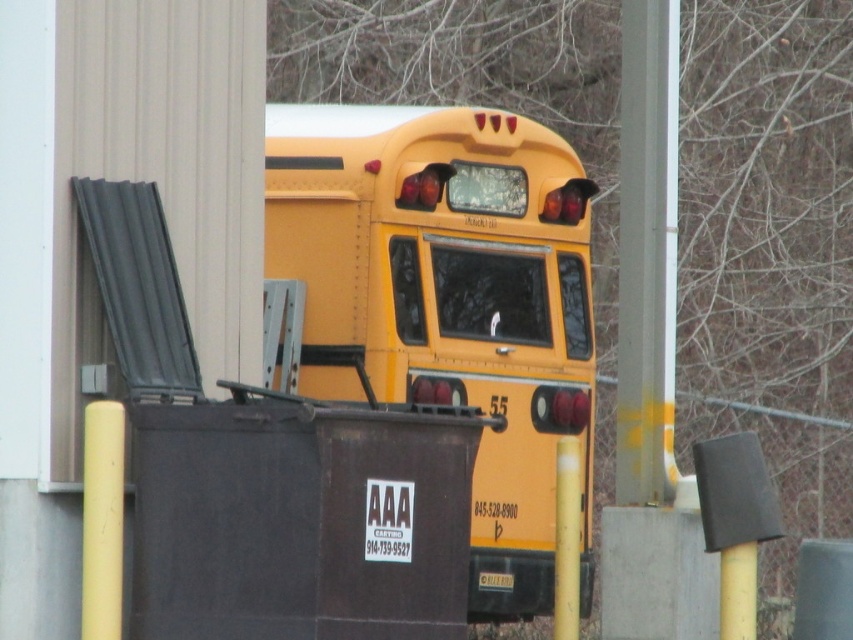
Who is shorter, yellow matte school bus at center or yellow matte pole at center?

With less height is yellow matte pole at center.

Does yellow matte school bus at center lie in front of yellow matte pole at center?

No, it is behind yellow matte pole at center.

Between point (387, 173) and point (567, 529), which one is positioned behind?

The point (387, 173) is more distant.

Where is `yellow matte school bus at center`? yellow matte school bus at center is located at coordinates (448, 300).